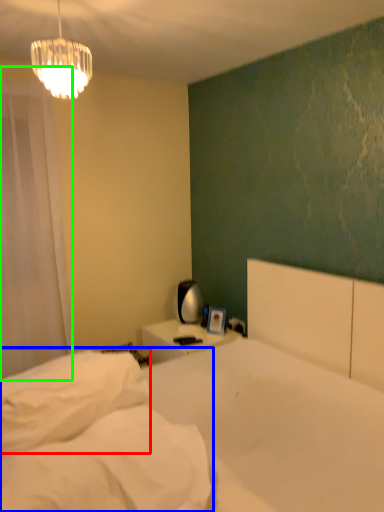
Question: Estimate the real-world distances between objects in this image. Which object is closer to pillow (highlighted by a red box), mattress (highlighted by a blue box) or curtain (highlighted by a green box)?

Choices:
 (A) mattress
 (B) curtain

Answer: (A)